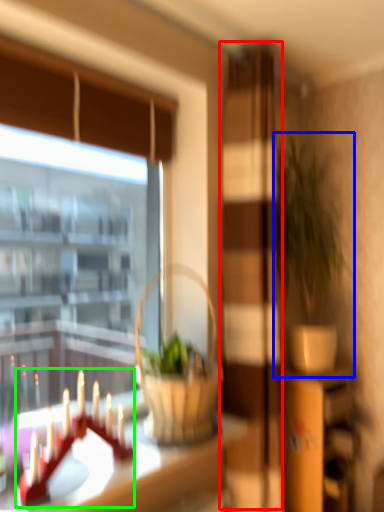
Question: Which object is positioned closest to screen door (highlighted by a red box)? Select from houseplant (highlighted by a blue box) and candle holder (highlighted by a green box).

Choices:
 (A) houseplant
 (B) candle holder

Answer: (A)